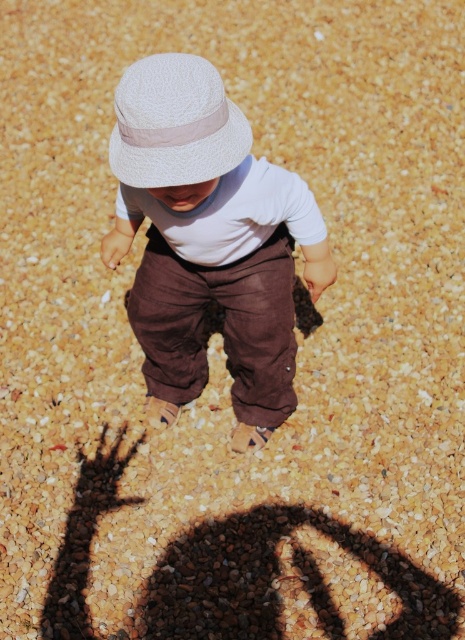
Question: Which object is closer to the camera taking this photo?

Choices:
 (A) white textured hat at upper center
 (B) matte white hat at center

Answer: (A)

Question: Is matte white hat at center wider than white textured hat at upper center?

Choices:
 (A) yes
 (B) no

Answer: (A)

Question: Can you confirm if matte white hat at center is positioned below white textured hat at upper center?

Choices:
 (A) yes
 (B) no

Answer: (A)

Question: Does matte white hat at center have a lesser width compared to white textured hat at upper center?

Choices:
 (A) no
 (B) yes

Answer: (A)

Question: Which object is farther from the camera taking this photo?

Choices:
 (A) white textured hat at upper center
 (B) matte white hat at center

Answer: (B)